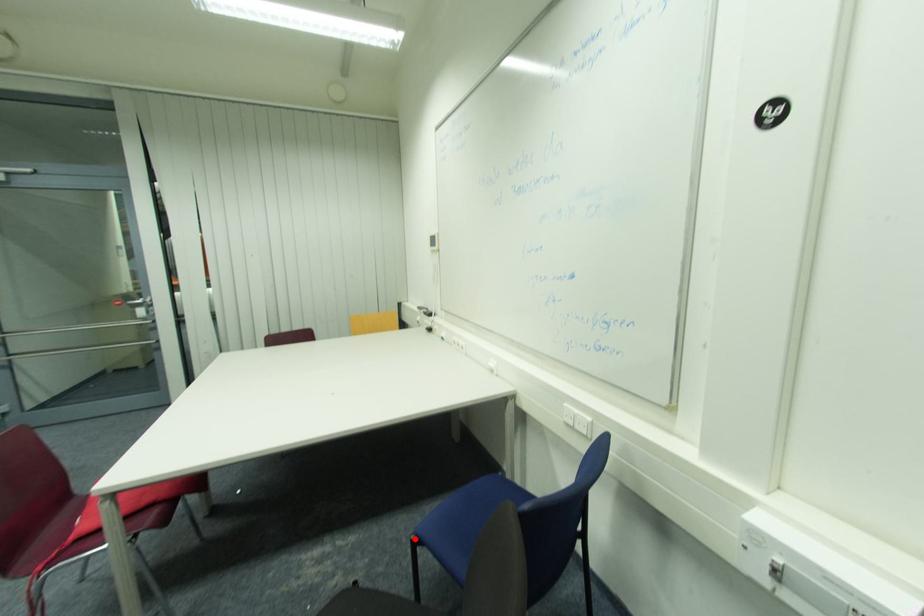
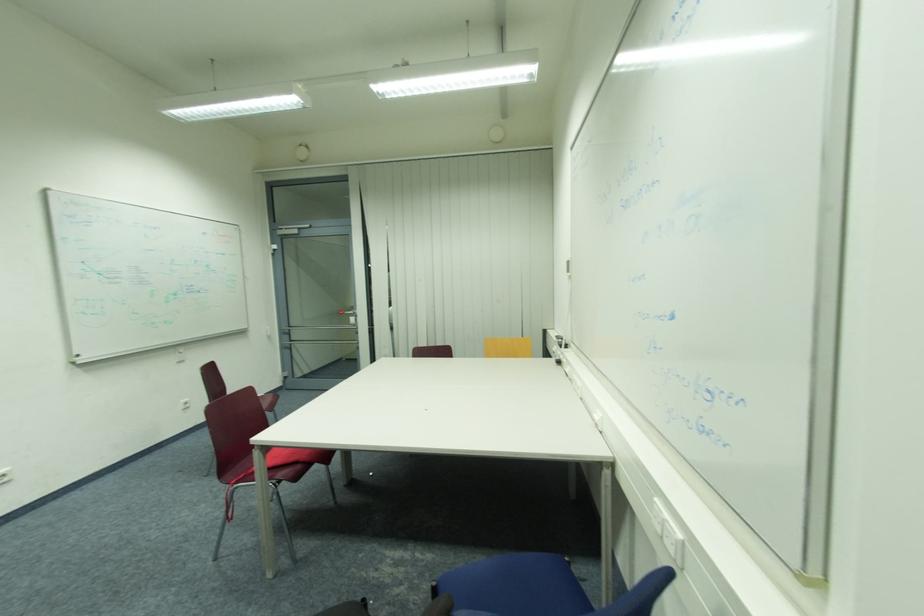
In the second image, find the point that corresponds to the highlighted location in the first image.

(439, 583)